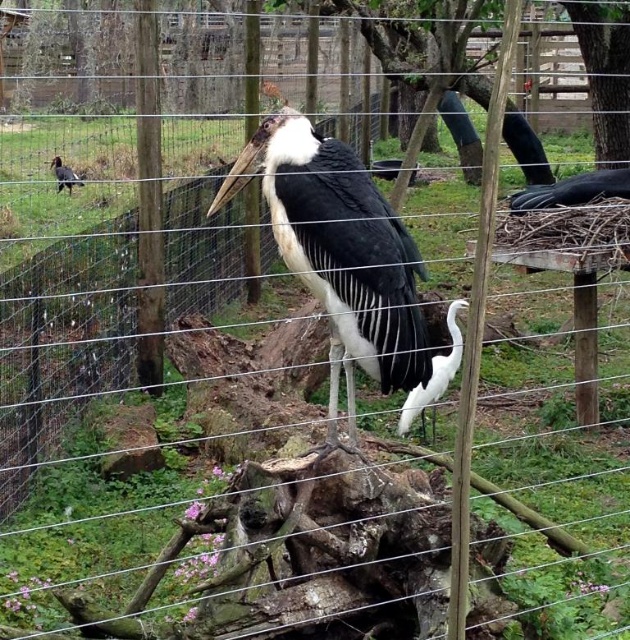
Based on the photo, you are a zookeeper observing the enclosure. You need to place a food bowl for the white feathered bird at center. Where should you position it relative to the bird?

The white feathered bird at center is located at point (340, 256), so you should place the food bowl near those coordinates to ensure the bird can easily access it.